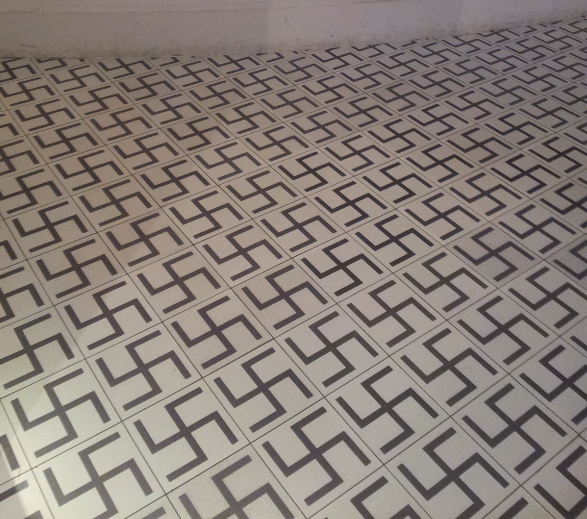
Locate an element on the screen. The image size is (587, 519). tile is located at coordinates (556, 490).